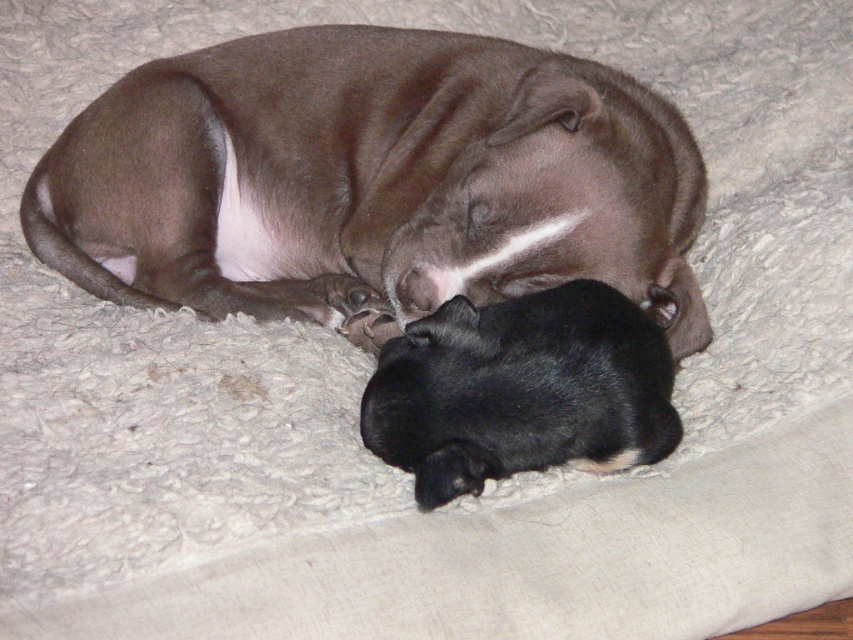
You are a photographer taking a picture of the brown smooth dog at center and the black fur at lower center. Which one is closer to your camera lens?

The brown smooth dog at center is closer to the camera lens because it is further to the viewer than the black fur at lower center.

You are a veterinarian examining this image of a mother dog and her puppies. Based on the scene, can you confirm if the brown smooth dog at center is larger than the black fur at lower center?

Yes, the brown smooth dog at center is bigger than the black fur at lower center according to the description.

Based on the scene description, what are the coordinates of the brown smooth dog at center?

The brown smooth dog at center is located at coordinates point (370, 180).